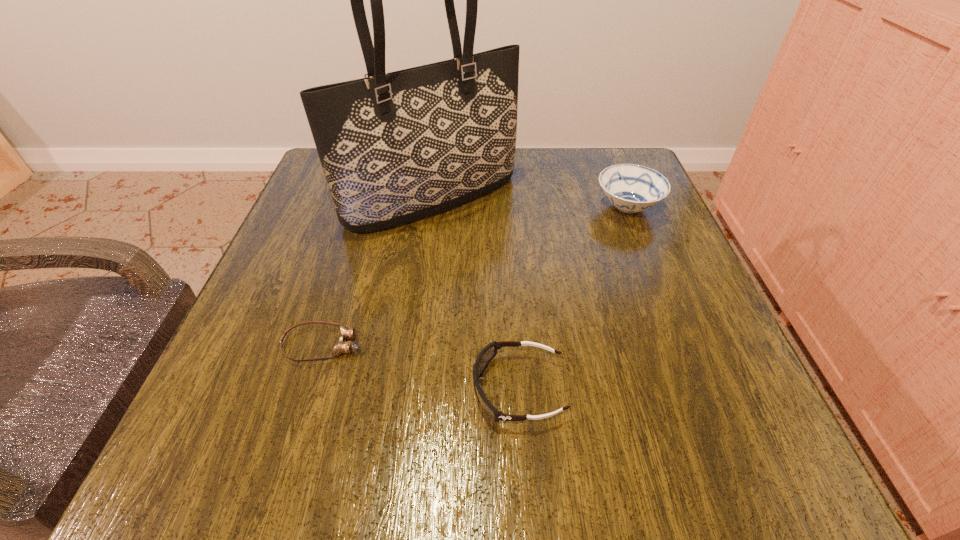
Identify the location of tote bag. (396, 147).

Find the location of `the rightmost object`. the rightmost object is located at coordinates (631, 188).

What are the coordinates of `the second tallest object` in the screenshot? It's located at (631, 188).

What are the coordinates of `the taller goggles` in the screenshot? It's located at (487, 353).

At what (x,y) coordinates should I click in order to perform the action: click on the third tallest object. Please return your answer as a coordinate pair (x, y). Looking at the image, I should click on (x=487, y=353).

Image resolution: width=960 pixels, height=540 pixels. I want to click on the left goggles, so click(x=342, y=346).

At what (x,y) coordinates should I click in order to perform the action: click on the shorter goggles. Please return your answer as a coordinate pair (x, y). Looking at the image, I should click on (342, 346).

Identify the location of vacant space located on the right of the tallest object. (602, 199).

Image resolution: width=960 pixels, height=540 pixels. I want to click on free space located on the front of the rightmost object, so click(x=660, y=289).

You are a GUI agent. You are given a task and a screenshot of the screen. Output one action in this format:
    pyautogui.click(x=<x>, y=<y>)
    Task: Click on the vacant space located on the front and sides of the taller goggles
    This screenshot has height=540, width=960.
    Given the screenshot: What is the action you would take?
    click(247, 389)